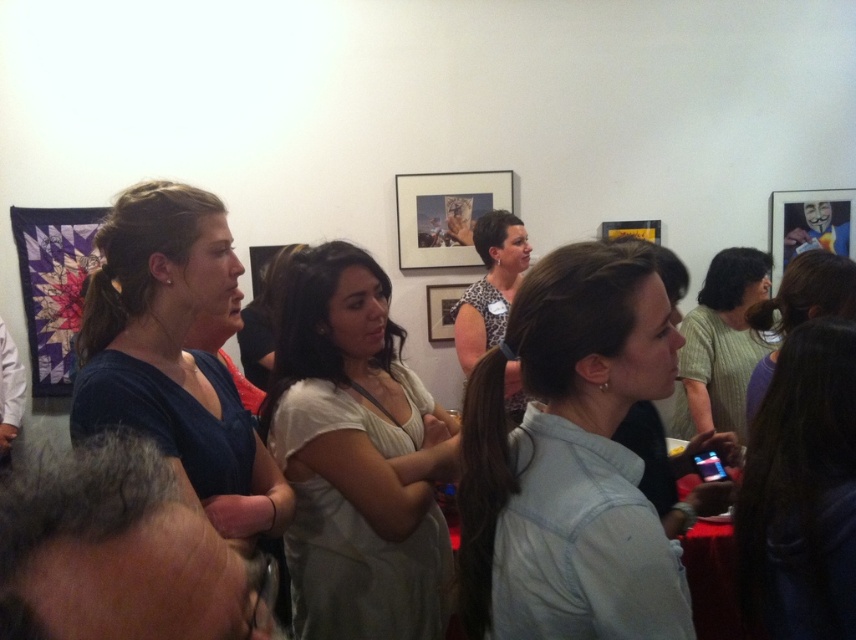
Question: Does knitted green sweater at center appear on the right side of dark brown hair at center?

Choices:
 (A) no
 (B) yes

Answer: (B)

Question: Which object is the closest to the blue matte shirt at center?

Choices:
 (A) dark brown hair at center
 (B) light blue denim shirt at center

Answer: (B)

Question: Which point is farther to the camera?

Choices:
 (A) leopard print blouse at center
 (B) dark brown hair at lower right
 (C) light blue denim shirt at center
 (D) knitted green sweater at center

Answer: (D)

Question: Is dark brown hair at lower right smaller than knitted green sweater at center?

Choices:
 (A) yes
 (B) no

Answer: (A)

Question: Does light blue denim shirt at center appear over blue matte shirt at center?

Choices:
 (A) yes
 (B) no

Answer: (A)

Question: Which of these objects is positioned farthest from the light blue denim shirt at center?

Choices:
 (A) knitted green sweater at center
 (B) dark brown hair at lower right
 (C) white cotton dress at center

Answer: (A)